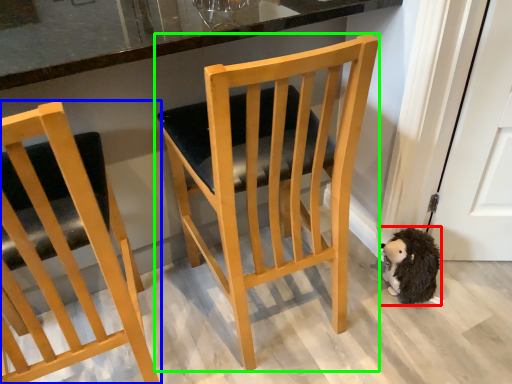
Question: Which object is positioned closest to animal (highlighted by a red box)? Select from chair (highlighted by a blue box) and chair (highlighted by a green box).

Choices:
 (A) chair
 (B) chair

Answer: (B)